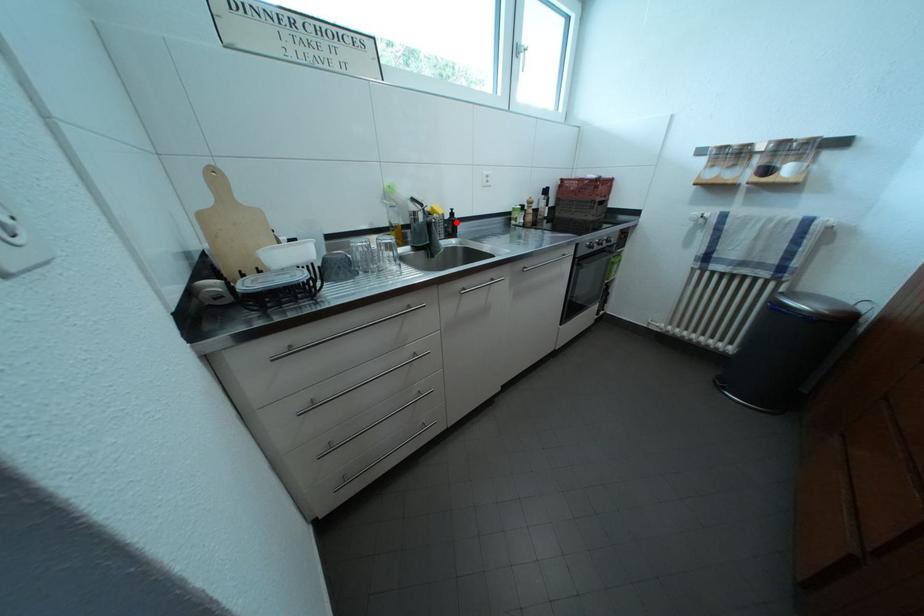
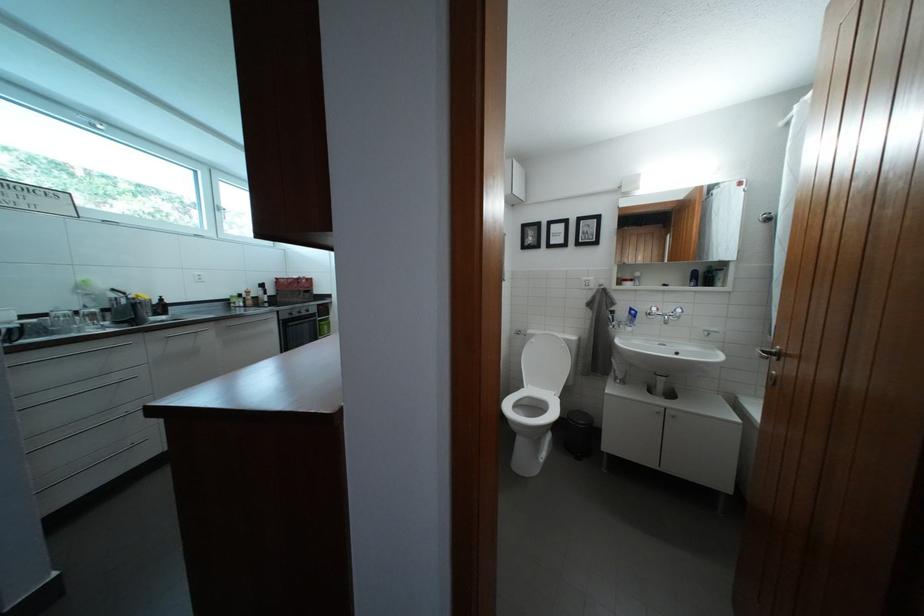
Question: I am providing you with two images of the same scene from different viewpoints. Given a red point in image1, look at the same physical point in image2. Is it:

Choices:
 (A) Closer to the viewpoint
 (B) Farther from the viewpoint

Answer: (B)